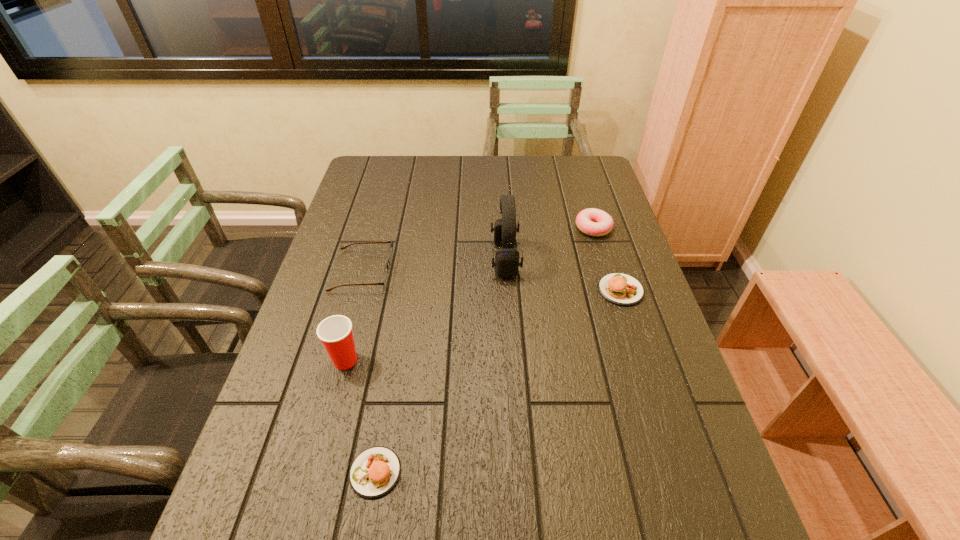
Where is `vacant region located on the right of the nearest object`? The height and width of the screenshot is (540, 960). vacant region located on the right of the nearest object is located at coordinates (498, 472).

Where is `vacant space located 0.180m on the back of the right patty`? vacant space located 0.180m on the back of the right patty is located at coordinates (603, 235).

Locate an element on the screen. The width and height of the screenshot is (960, 540). free space located on the headband of the third object from right to left is located at coordinates (390, 259).

Where is `blank space located 0.330m on the headband of the third object from right to left`? The image size is (960, 540). blank space located 0.330m on the headband of the third object from right to left is located at coordinates (380, 259).

Locate an element on the screen. vacant space located 0.330m on the headband of the third object from right to left is located at coordinates (380, 259).

Find the location of `free location located 0.400m on the front-facing side of the spectacles`. free location located 0.400m on the front-facing side of the spectacles is located at coordinates (529, 271).

This screenshot has width=960, height=540. Find the location of `vacant region located on the left of the doughnut`. vacant region located on the left of the doughnut is located at coordinates click(x=475, y=228).

The image size is (960, 540). I want to click on vacant point located on the right of the Dixie cup, so coord(450,360).

The image size is (960, 540). In order to click on object situated at the near edge in this screenshot , I will do click(374, 472).

Locate an element on the screen. Image resolution: width=960 pixels, height=540 pixels. spectacles positioned at the left edge is located at coordinates (390, 253).